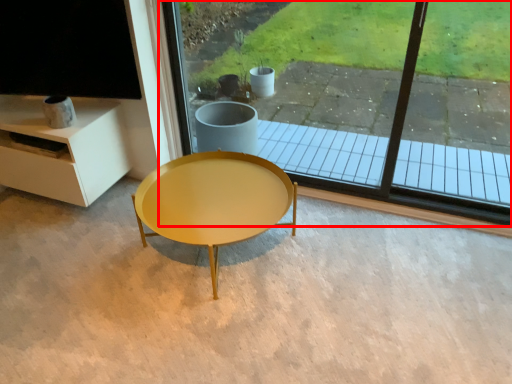
Question: Observing the image, what is the correct spatial positioning of window (annotated by the red box) in reference to coffee table?

Choices:
 (A) left
 (B) right

Answer: (B)